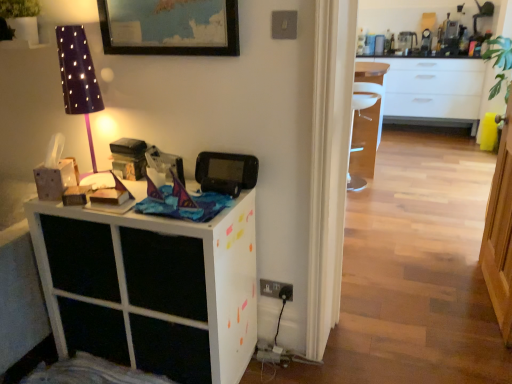
Question: Is black plastic game console at upper center facing towards white matte cabinet at left?

Choices:
 (A) no
 (B) yes

Answer: (A)

Question: Is black plastic game console at upper center looking in the opposite direction of white matte cabinet at left?

Choices:
 (A) yes
 (B) no

Answer: (B)

Question: Is black plastic game console at upper center bigger than white matte cabinet at left?

Choices:
 (A) yes
 (B) no

Answer: (B)

Question: Is black plastic game console at upper center positioned in front of white matte cabinet at left?

Choices:
 (A) yes
 (B) no

Answer: (B)

Question: Is white matte cabinet at left inside black plastic game console at upper center?

Choices:
 (A) yes
 (B) no

Answer: (B)

Question: Does black plastic game console at upper center have a greater width compared to white matte cabinet at left?

Choices:
 (A) no
 (B) yes

Answer: (A)

Question: Can you confirm if purple dotted fabric lampshade at upper left is thinner than black plastic game console at upper center?

Choices:
 (A) yes
 (B) no

Answer: (B)

Question: Can you confirm if purple dotted fabric lampshade at upper left is positioned to the right of black plastic game console at upper center?

Choices:
 (A) no
 (B) yes

Answer: (A)

Question: Is purple dotted fabric lampshade at upper left not near black plastic game console at upper center?

Choices:
 (A) no
 (B) yes

Answer: (A)

Question: From a real-world perspective, is purple dotted fabric lampshade at upper left beneath black plastic game console at upper center?

Choices:
 (A) yes
 (B) no

Answer: (B)

Question: Is purple dotted fabric lampshade at upper left shorter than black plastic game console at upper center?

Choices:
 (A) no
 (B) yes

Answer: (A)

Question: Is purple dotted fabric lampshade at upper left not inside black plastic game console at upper center?

Choices:
 (A) yes
 (B) no

Answer: (A)

Question: Is purple dotted fabric lampshade at upper left inside black plastic game console at upper center?

Choices:
 (A) no
 (B) yes

Answer: (A)